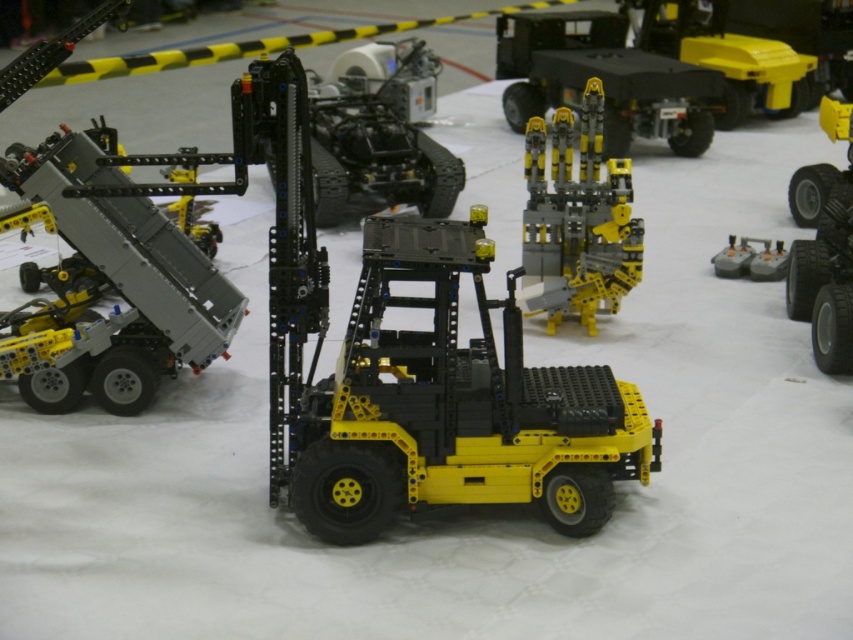
Looking at this image, you are a judge at a robotics competition and need to evaluate the LEGO models displayed on the white surface. You notice two points marked on the image at coordinates point (160, 321) and point (782, 266). Which of these points is closer to the camera from your viewing perspective?

Point (160, 321) is closer to the camera than point (782, 266).

Consider the image. You are a judge at a robotics competition and need to locate the yellow matte black plastic forklift at center. Using the coordinate system where the bottom left corner is the origin, can you confirm if the point at (454, 404) marks its location?

Yes, the yellow matte black plastic forklift at center is represented by point (454, 404), so the coordinates are correct.